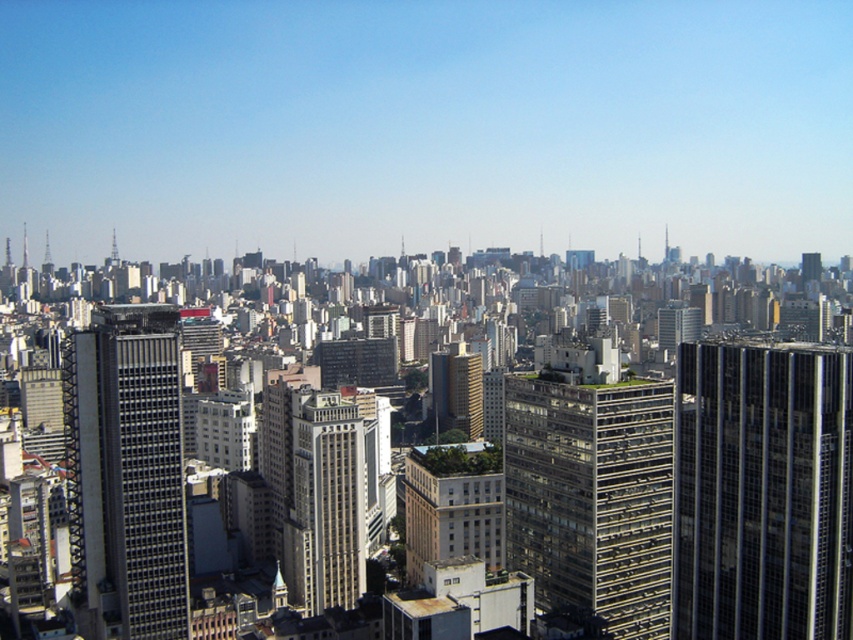
You are a drone operator planning to fly a drone from your current position to the black glass skyscraper at right. The drone has a maximum flight range of 300 meters. Based on the scene, can the drone reach the skyscraper?

The distance between the black glass skyscraper at right and the camera is 329.33 meters. Since the drone has a maximum range of 300 meters, it cannot reach the skyscraper.

You are standing at the center of the city looking out. You see a black glass skyscraper at right. Based on its coordinates, is it located closer to the edge of the frame or the center?

The black glass skyscraper at right is located closer to the edge of the frame since its coordinates are at point (762, 492), which places it near the lower right corner of the frame.

You are a drone operator who needs to deliver a package to the black glass skyscraper at right. The drone has a maximum flight range of 1000 feet. Based on the cityscape scene, can the drone reach the skyscraper?

The black glass skyscraper at right is 1080.49 feet from the camera, which exceeds the drone operator maximum flight range of 1000 feet. The drone cannot reach the skyscraper.